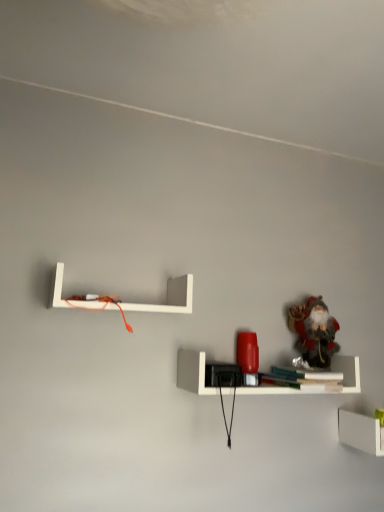
Question: In the image, is frosted glass santa at upper right on the left side or the right side of white matte shelf at lower right, the 3th shelf from the left?

Choices:
 (A) left
 (B) right

Answer: (A)

Question: Is frosted glass santa at upper right taller or shorter than white matte shelf at lower right, the 3th shelf from the left?

Choices:
 (A) tall
 (B) short

Answer: (A)

Question: Estimate the real-world distances between objects in this image. Which object is closer to the frosted glass santa at upper right?

Choices:
 (A) matte red lamp at center, acting as the 2th shelf starting from the top
 (B) white matte shelf at upper left, placed as the 3th shelf when sorted from right to left
 (C) white matte shelf at lower right, marked as the first shelf in a bottom-to-top arrangement
 (D) white matte line at upper center

Answer: (A)

Question: Which object is positioned closest to the matte red lamp at center, the 2th shelf in the bottom-to-top sequence?

Choices:
 (A) frosted glass santa at upper right
 (B) white matte shelf at lower right, which appears as the 1th shelf when viewed from the right
 (C) white matte shelf at upper left, marked as the 3th shelf in a bottom-to-top arrangement
 (D) white matte line at upper center

Answer: (A)